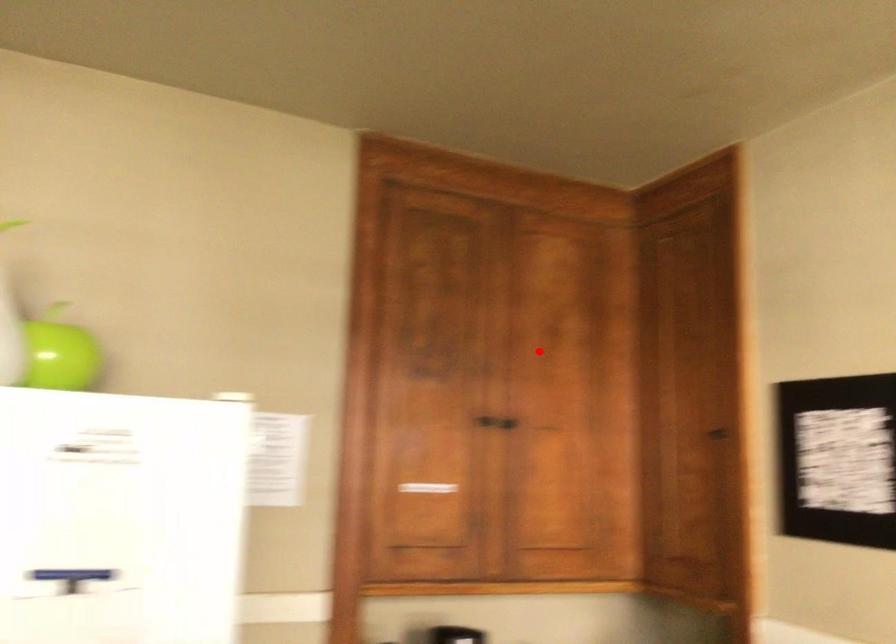
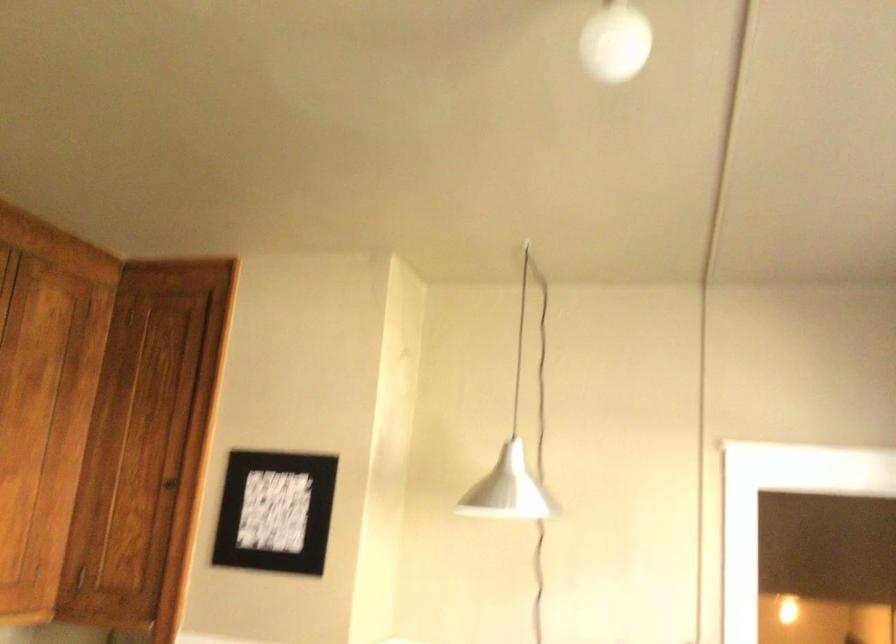
Find the pixel in the second image that matches the highlighted location in the first image.

(23, 397)